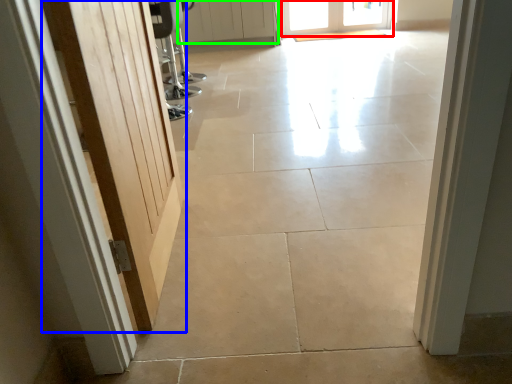
Question: Estimate the real-world distances between objects in this image. Which object is closer to door (highlighted by a red box), door (highlighted by a blue box) or door (highlighted by a green box)?

Choices:
 (A) door
 (B) door

Answer: (B)